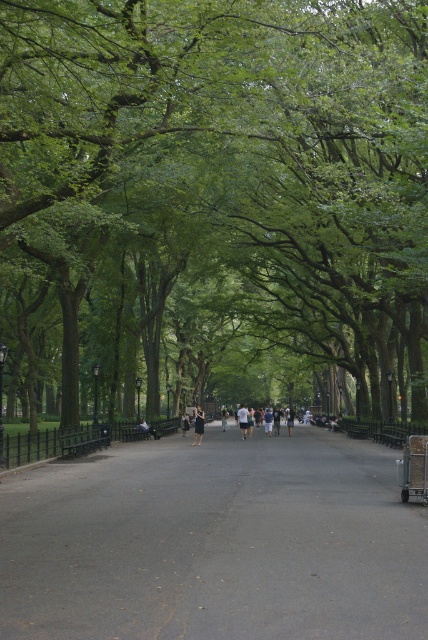
Question: Observing the image, what is the correct spatial positioning of dark gray t-shirt at center in reference to dark blue jeans at center?

Choices:
 (A) above
 (B) below

Answer: (B)

Question: Which of the following is the farthest from the observer?

Choices:
 (A) black dress at center
 (B) dark asphalt road at center
 (C) dark gray t-shirt at center

Answer: (C)

Question: Can you confirm if dark asphalt road at center is positioned to the left of dark gray t-shirt at center?

Choices:
 (A) no
 (B) yes

Answer: (A)

Question: Which of the following is the farthest from the observer?

Choices:
 (A) click(202, 422)
 (B) click(95, 605)

Answer: (A)

Question: Can you confirm if dark asphalt road at center is positioned above dark blue jeans at center?

Choices:
 (A) no
 (B) yes

Answer: (B)

Question: Which of the following is the closest to the observer?

Choices:
 (A) (202, 419)
 (B) (184, 417)
 (C) (246, 416)
 (D) (234, 168)

Answer: (D)